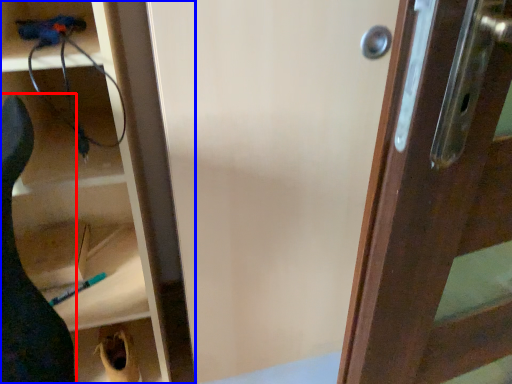
Question: Which point is closer to the camera, animal (highlighted by a red box) or cabinetry (highlighted by a blue box)?

Choices:
 (A) animal
 (B) cabinetry

Answer: (A)